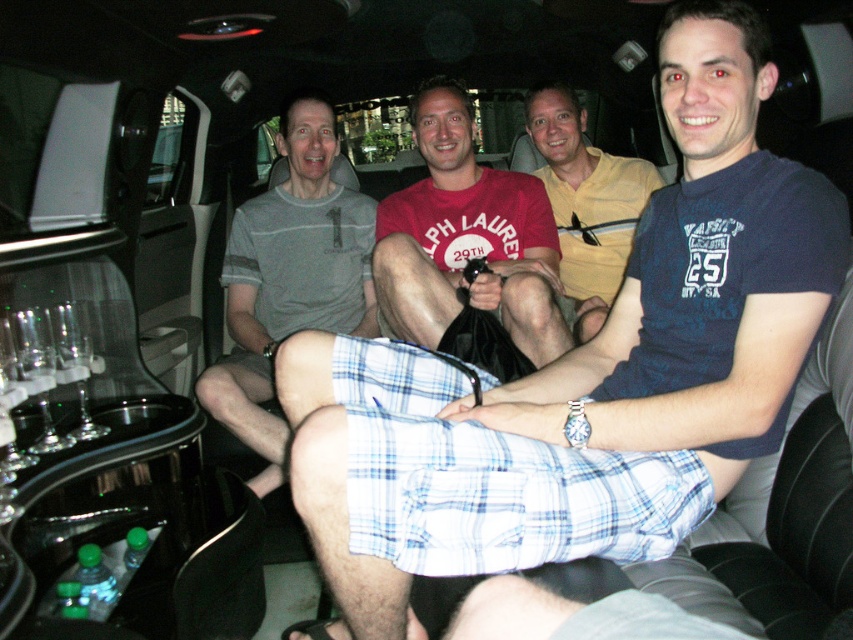
Does matte red t-shirt at center appear under yellow cotton shirt at center?

Yes.

Does matte red t-shirt at center have a greater width compared to yellow cotton shirt at center?

Yes, matte red t-shirt at center is wider than yellow cotton shirt at center.

Where is `matte red t-shirt at center`? This screenshot has width=853, height=640. matte red t-shirt at center is located at coordinates (466, 237).

This screenshot has height=640, width=853. I want to click on matte red t-shirt at center, so click(x=466, y=237).

Is gray striped shirt at center positioned behind matte red t-shirt at center?

Yes, it is.

What do you see at coordinates (289, 276) in the screenshot? I see `gray striped shirt at center` at bounding box center [289, 276].

The height and width of the screenshot is (640, 853). Identify the location of gray striped shirt at center. (289, 276).

Does gray striped shirt at center appear on the left side of yellow cotton shirt at center?

Yes, gray striped shirt at center is to the left of yellow cotton shirt at center.

Can you confirm if gray striped shirt at center is bigger than yellow cotton shirt at center?

Yes.

Between point (355, 330) and point (579, 138), which one is positioned in front?

Point (355, 330)

You are a GUI agent. You are given a task and a screenshot of the screen. Output one action in this format:
    pyautogui.click(x=<x>, y=<y>)
    Task: Click on the gray striped shirt at center
    The width and height of the screenshot is (853, 640).
    Given the screenshot: What is the action you would take?
    pyautogui.click(x=289, y=276)